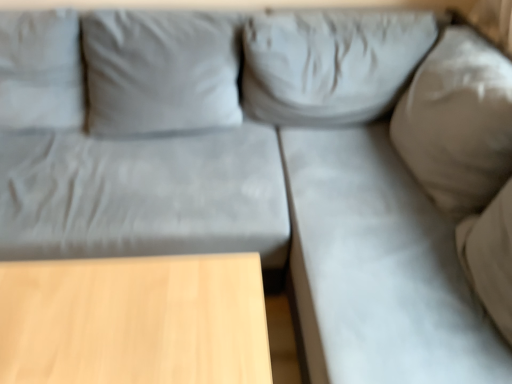
In order to click on gray fabric couch at right in this screenshot , I will do `click(379, 269)`.

What do you see at coordinates (379, 269) in the screenshot?
I see `gray fabric couch at right` at bounding box center [379, 269].

The width and height of the screenshot is (512, 384). What do you see at coordinates (134, 320) in the screenshot?
I see `light wood table at lower left` at bounding box center [134, 320].

This screenshot has width=512, height=384. In order to click on light wood table at lower left in this screenshot , I will do `click(134, 320)`.

Where is `gray fabric couch at right`? This screenshot has width=512, height=384. gray fabric couch at right is located at coordinates (379, 269).

Between light wood table at lower left and gray fabric couch at right, which one appears on the left side from the viewer's perspective?

light wood table at lower left is more to the left.

Does light wood table at lower left lie behind gray fabric couch at right?

Yes.

Does point (42, 333) come in front of point (312, 302)?

Yes, point (42, 333) is closer to viewer.

From the image's perspective, is light wood table at lower left above or below gray fabric couch at right?

light wood table at lower left is situated lower than gray fabric couch at right in the image.

From a real-world perspective, is light wood table at lower left on gray fabric couch at right?

Incorrect, from a real-world perspective, light wood table at lower left is lower than gray fabric couch at right.

Looking at their sizes, would you say light wood table at lower left is wider or thinner than gray fabric couch at right?

Clearly, light wood table at lower left has less width compared to gray fabric couch at right.

Is light wood table at lower left taller than gray fabric couch at right?

No.

Considering the relative sizes of light wood table at lower left and gray fabric couch at right in the image provided, is light wood table at lower left smaller than gray fabric couch at right?

Indeed, light wood table at lower left has a smaller size compared to gray fabric couch at right.

Which is correct: light wood table at lower left is inside gray fabric couch at right, or outside of it?

light wood table at lower left lies outside gray fabric couch at right.

Are light wood table at lower left and gray fabric couch at right located far from each other?

No, light wood table at lower left is not far from gray fabric couch at right.

Does light wood table at lower left turn towards gray fabric couch at right?

No.

Locate an element on the screen. Image resolution: width=512 pixels, height=384 pixels. table below the gray fabric couch at right (from a real-world perspective) is located at coordinates (134, 320).

Considering the relative positions of gray fabric couch at right and light wood table at lower left in the image provided, is gray fabric couch at right to the left of light wood table at lower left from the viewer's perspective?

In fact, gray fabric couch at right is to the right of light wood table at lower left.

Does gray fabric couch at right come behind light wood table at lower left?

That is False.

Is point (407, 359) less distant than point (131, 331)?

No, it is behind (131, 331).

From the image's perspective, which is below, gray fabric couch at right or light wood table at lower left?

light wood table at lower left is shown below in the image.

From a real-world perspective, is gray fabric couch at right on light wood table at lower left?

Indeed, from a real-world perspective, gray fabric couch at right stands above light wood table at lower left.

Considering the relative sizes of gray fabric couch at right and light wood table at lower left in the image provided, is gray fabric couch at right wider than light wood table at lower left?

Yes.

Who is shorter, gray fabric couch at right or light wood table at lower left?

Standing shorter between the two is light wood table at lower left.

Between gray fabric couch at right and light wood table at lower left, which one has smaller size?

Smaller between the two is light wood table at lower left.

Is light wood table at lower left a part of gray fabric couch at right?

Actually, light wood table at lower left is outside gray fabric couch at right.

Are gray fabric couch at right and light wood table at lower left far apart?

Actually, gray fabric couch at right and light wood table at lower left are a little close together.

Is gray fabric couch at right looking in the opposite direction of light wood table at lower left?

No, gray fabric couch at right is not facing away from light wood table at lower left.

Can you tell me how much gray fabric couch at right and light wood table at lower left differ in facing direction?

The angle between the facing direction of gray fabric couch at right and the facing direction of light wood table at lower left is 89.5 degrees.

This screenshot has width=512, height=384. Identify the location of sheet on the right of the light wood table at lower left. (379, 269).

At what (x,y) coordinates should I click in order to perform the action: click on table behind the gray fabric couch at right. Please return your answer as a coordinate pair (x, y). This screenshot has width=512, height=384. Looking at the image, I should click on (134, 320).

The width and height of the screenshot is (512, 384). There is a light wood table at lower left. Identify the location of sheet above it (from a real-world perspective). (379, 269).